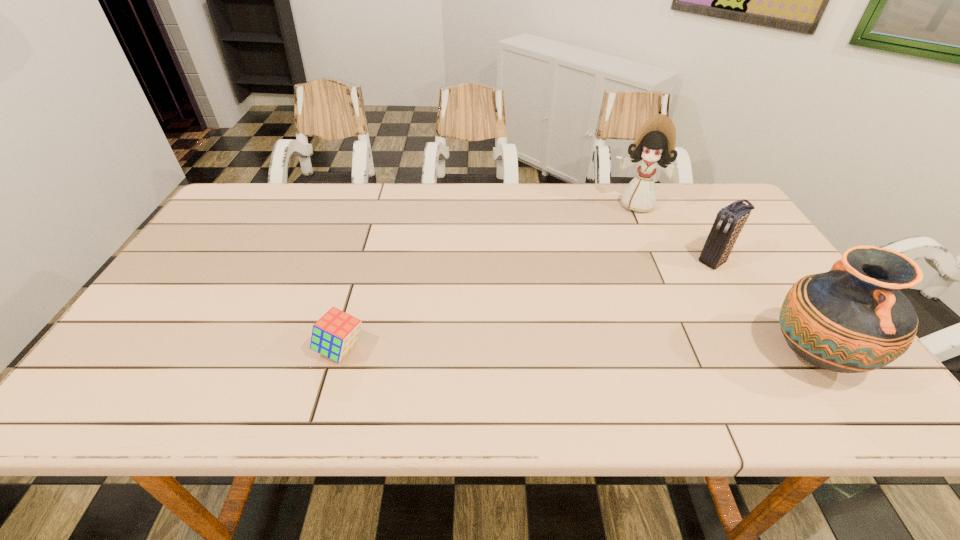
Find the location of a particular element. the leftmost object is located at coordinates (336, 332).

The image size is (960, 540). In order to click on the shortest object in this screenshot , I will do `click(336, 332)`.

This screenshot has width=960, height=540. Find the location of `pottery`. pottery is located at coordinates (852, 319).

You are a GUI agent. You are given a task and a screenshot of the screen. Output one action in this format:
    pyautogui.click(x=<x>, y=<y>)
    Task: Click on the second farthest object
    Image resolution: width=960 pixels, height=540 pixels.
    Given the screenshot: What is the action you would take?
    pyautogui.click(x=730, y=220)

Where is `clutch bag`? Image resolution: width=960 pixels, height=540 pixels. clutch bag is located at coordinates (730, 220).

Locate an element on the screen. This screenshot has width=960, height=540. doll is located at coordinates (654, 146).

Find the location of `the farthest object`. the farthest object is located at coordinates (654, 146).

The image size is (960, 540). I want to click on free space located 0.170m on the right of the shortest object, so click(440, 349).

Identify the location of vacant space located on the back of the pottery. (750, 262).

At what (x,y) coordinates should I click in order to perform the action: click on free location located with the zip open on the clutch bag. Please return your answer as a coordinate pair (x, y). Looking at the image, I should click on (601, 334).